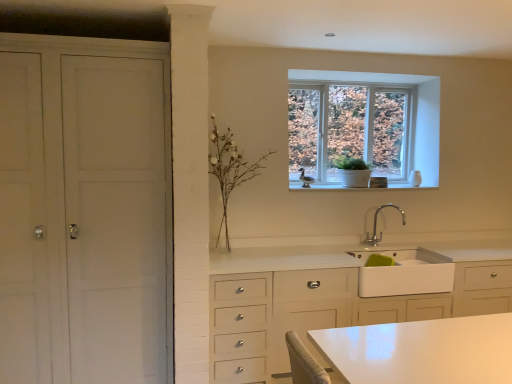
Question: Does white matte cabinet at left appear on the right side of white matte plant at center?

Choices:
 (A) no
 (B) yes

Answer: (A)

Question: From the image's perspective, would you say white matte cabinet at left is positioned over white matte plant at center?

Choices:
 (A) yes
 (B) no

Answer: (B)

Question: Is white matte cabinet at left looking in the opposite direction of white matte plant at center?

Choices:
 (A) yes
 (B) no

Answer: (B)

Question: Is white matte cabinet at left with white matte plant at center?

Choices:
 (A) no
 (B) yes

Answer: (A)

Question: Is white matte cabinet at left positioned before white matte plant at center?

Choices:
 (A) yes
 (B) no

Answer: (A)

Question: From a real-world perspective, is white matte cabinet at left on white matte plant at center?

Choices:
 (A) yes
 (B) no

Answer: (B)

Question: Is silver metallic faucet at upper center taller than clear glass window at upper center?

Choices:
 (A) no
 (B) yes

Answer: (A)

Question: From the image's perspective, is silver metallic faucet at upper center located above clear glass window at upper center?

Choices:
 (A) yes
 (B) no

Answer: (B)

Question: Is silver metallic faucet at upper center positioned beyond the bounds of clear glass window at upper center?

Choices:
 (A) no
 (B) yes

Answer: (B)

Question: Is silver metallic faucet at upper center directly adjacent to clear glass window at upper center?

Choices:
 (A) no
 (B) yes

Answer: (A)

Question: Would you say clear glass window at upper center is part of silver metallic faucet at upper center's contents?

Choices:
 (A) yes
 (B) no

Answer: (B)

Question: Is silver metallic faucet at upper center wider than clear glass window at upper center?

Choices:
 (A) yes
 (B) no

Answer: (A)

Question: Considering the relative sizes of white matte sink at lower center and clear glass window at upper center in the image provided, is white matte sink at lower center taller than clear glass window at upper center?

Choices:
 (A) no
 (B) yes

Answer: (A)